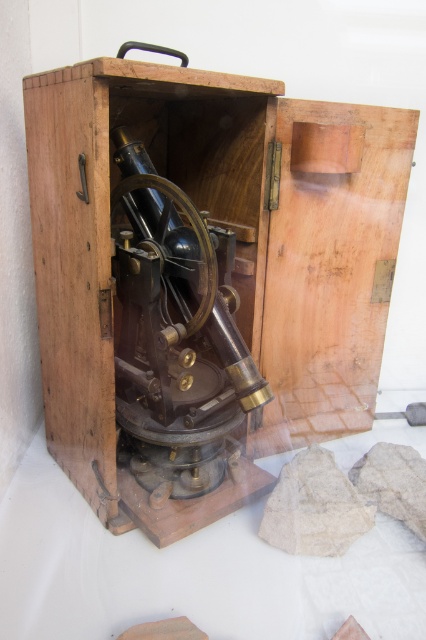
You are an archaeologist examining the vintage surveying instrument. You need to determine the relative positioning of the wooden box at center and the polished brass telescope at center. Which object is positioned to the right?

The wooden box at center is positioned to the right of the polished brass telescope at center, so the wooden box at center is the one on the right side.

You are an antique collector examining the vintage surveying instrument. You need to determine if the polished brass telescope at center can be safely stored inside the wooden box at center. Based on their sizes, can it fit vertically?

The wooden box at center is much taller than the polished brass telescope at center, so yes, the telescope can be stored vertically inside the wooden box at center.

In the scene shown: You are a museum curator preparing to display the theodolite. The wooden box at center and the polished brass telescope at center are part of the exhibit. Which object should you prioritize securing with anti theft measures, considering their sizes?

The wooden box at center is larger in size than the polished brass telescope at center, so it would be more challenging to secure properly. Prioritize securing the wooden box at center with anti theft measures.